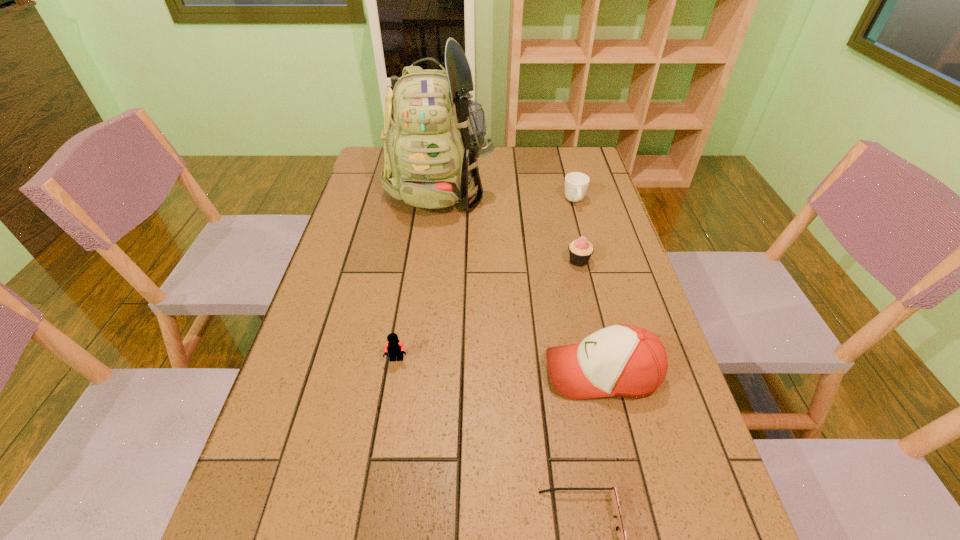
Find the location of a particular element. This screenshot has height=540, width=960. the tallest object is located at coordinates (433, 135).

Where is `baseball cap`? baseball cap is located at coordinates (621, 360).

This screenshot has width=960, height=540. Find the location of `the third farthest object`. the third farthest object is located at coordinates [x=580, y=250].

This screenshot has width=960, height=540. In order to click on Lego in this screenshot , I will do `click(395, 348)`.

The width and height of the screenshot is (960, 540). I want to click on cup, so click(x=576, y=183).

Where is `free space located on the front-facing side of the tallest object`? This screenshot has height=540, width=960. free space located on the front-facing side of the tallest object is located at coordinates (425, 309).

The image size is (960, 540). In order to click on free space located 0.200m on the front-facing side of the fifth shortest object in this screenshot , I will do `click(455, 373)`.

Locate an element on the screen. The image size is (960, 540). vacant area situated on the front-facing side of the fifth shortest object is located at coordinates (419, 373).

You are a GUI agent. You are given a task and a screenshot of the screen. Output one action in this format:
    pyautogui.click(x=<x>, y=<y>)
    Task: Click on the free space located 0.180m on the front-facing side of the fifth shortest object
    This screenshot has height=540, width=960.
    Given the screenshot: What is the action you would take?
    pyautogui.click(x=464, y=373)

Locate an element on the screen. The image size is (960, 540). free space located 0.280m on the left of the third farthest object is located at coordinates (468, 261).